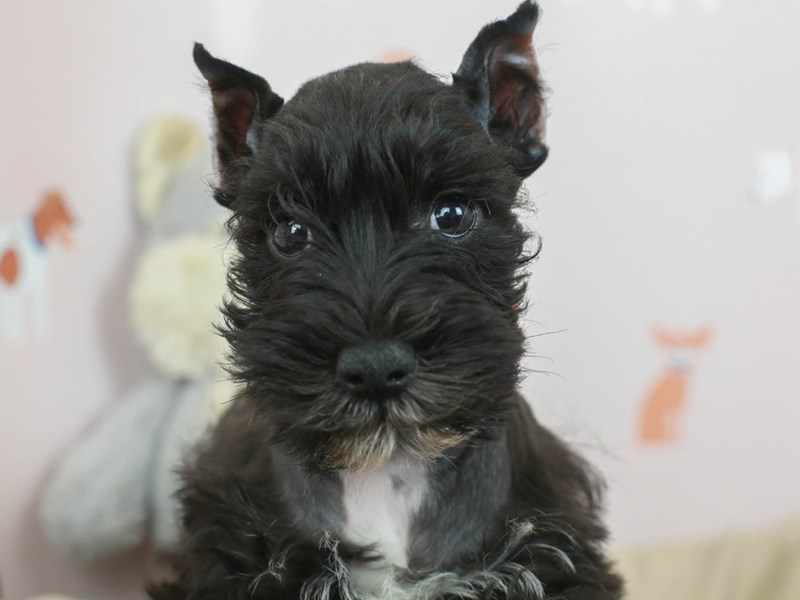
In order to click on beige and light gray big teddy bear in this screenshot , I will do `click(184, 314)`, `click(124, 461)`.